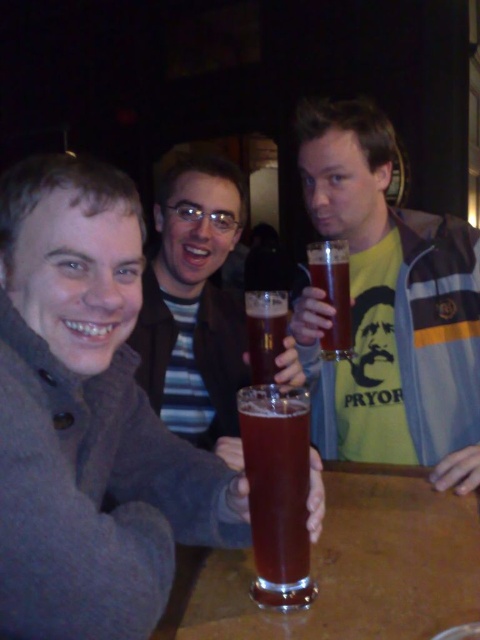
Question: Does brown glass at center have a smaller size compared to translucent glass beer at center?

Choices:
 (A) no
 (B) yes

Answer: (B)

Question: Can you confirm if transparent glass at center is positioned above translucent glass beer at center?

Choices:
 (A) no
 (B) yes

Answer: (A)

Question: Which point is closer to the camera?

Choices:
 (A) (348, 268)
 (B) (171, 266)

Answer: (A)

Question: Estimate the real-world distances between objects in this image. Which object is farther from the translucent glass mug at center?

Choices:
 (A) transparent glass at center
 (B) translucent glass beer at center
 (C) matte brown jacket at center
 (D) matte yellow t-shirt at center

Answer: (D)

Question: Which of these objects is positioned closest to the translucent glass beer at center?

Choices:
 (A) matte brown jacket at left
 (B) matte yellow t-shirt at center
 (C) matte brown jacket at center

Answer: (C)

Question: Considering the relative positions of matte brown jacket at left and matte brown jacket at center in the image provided, where is matte brown jacket at left located with respect to matte brown jacket at center?

Choices:
 (A) below
 (B) above

Answer: (A)